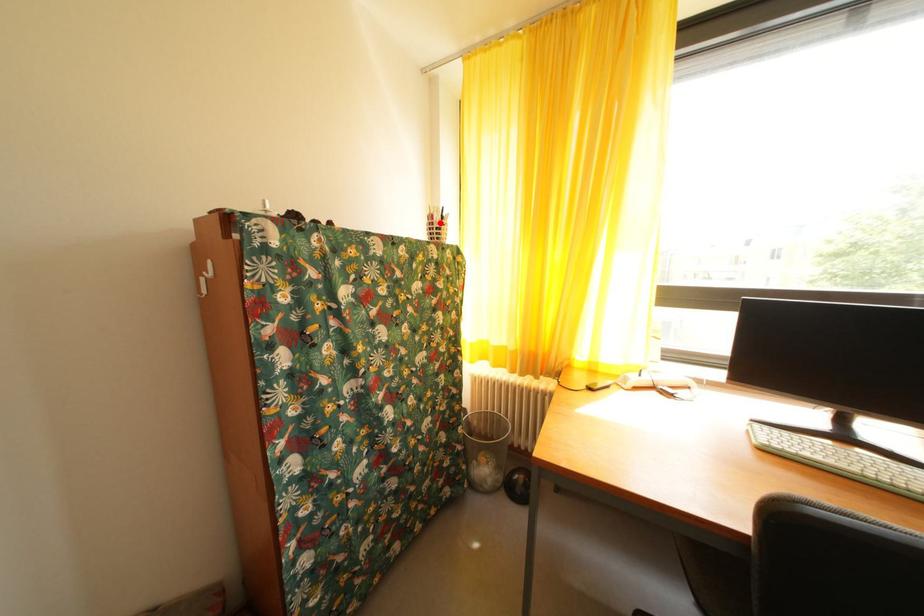
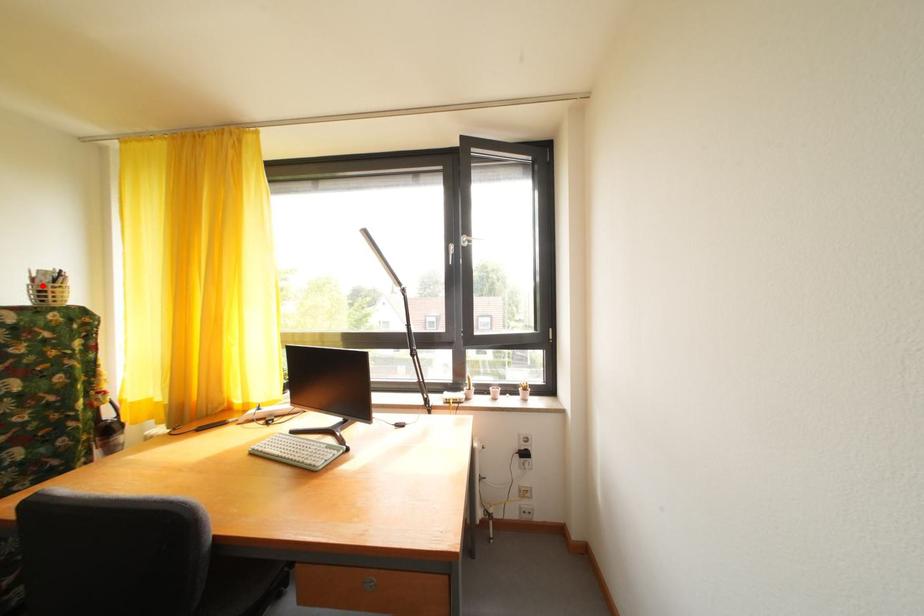
I am providing you with two images of the same scene from different viewpoints. A red point is marked on the first image and another point is marked on the second image. Does the point marked in image1 correspond to the same location as the one in image2?

Yes